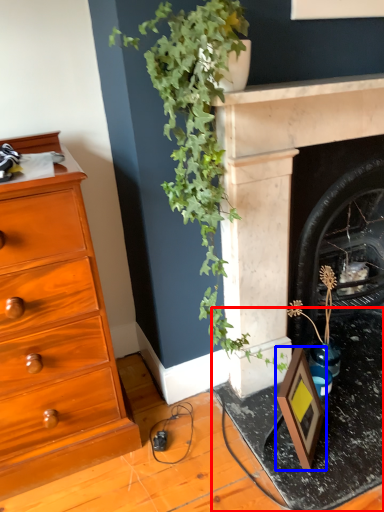
Question: Which point is further to the camera, table (highlighted by a red box) or picture frame (highlighted by a blue box)?

Choices:
 (A) table
 (B) picture frame

Answer: (B)